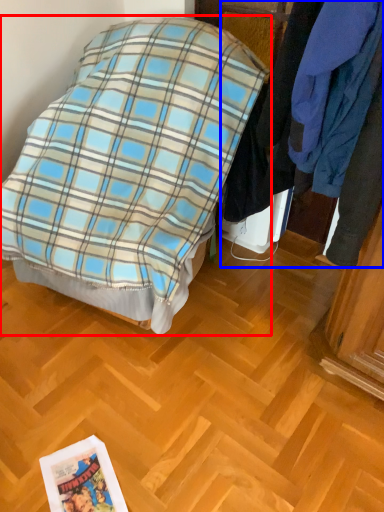
Question: Which object is closer to the camera taking this photo, bed (highlighted by a red box) or closet (highlighted by a blue box)?

Choices:
 (A) bed
 (B) closet

Answer: (B)